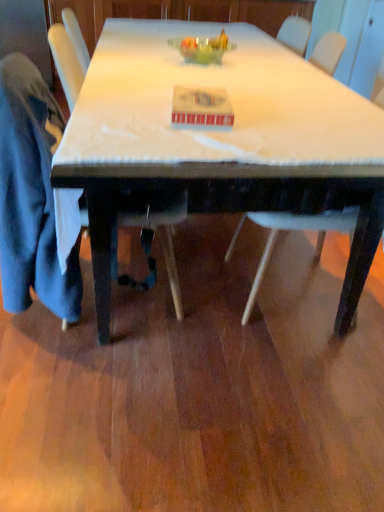
Question: Considering their positions, is velvet blue jacket at left, the 2th chair from the right, located in front of or behind white plastic chair at lower right, positioned as the 1th chair in right-to-left order?

Choices:
 (A) front
 (B) behind

Answer: (A)

Question: Would you say velvet blue jacket at left, arranged as the first chair when viewed from the left, is to the left or to the right of white plastic chair at lower right, arranged as the 2th chair when viewed from the left, in the picture?

Choices:
 (A) right
 (B) left

Answer: (B)

Question: Which object is positioned closest to the white glossy table at center?

Choices:
 (A) white plastic chair at lower right, arranged as the 2th chair when viewed from the left
 (B) velvet blue jacket at left, arranged as the first chair when viewed from the left
 (C) blue cotton robe at left
 (D) translucent glass bowl at center

Answer: (B)

Question: Which of these objects is positioned closest to the white glossy table at center?

Choices:
 (A) blue cotton robe at left
 (B) white plastic chair at lower right, arranged as the 2th chair when viewed from the left
 (C) translucent glass bowl at center
 (D) velvet blue jacket at left, the 2th chair from the right

Answer: (D)